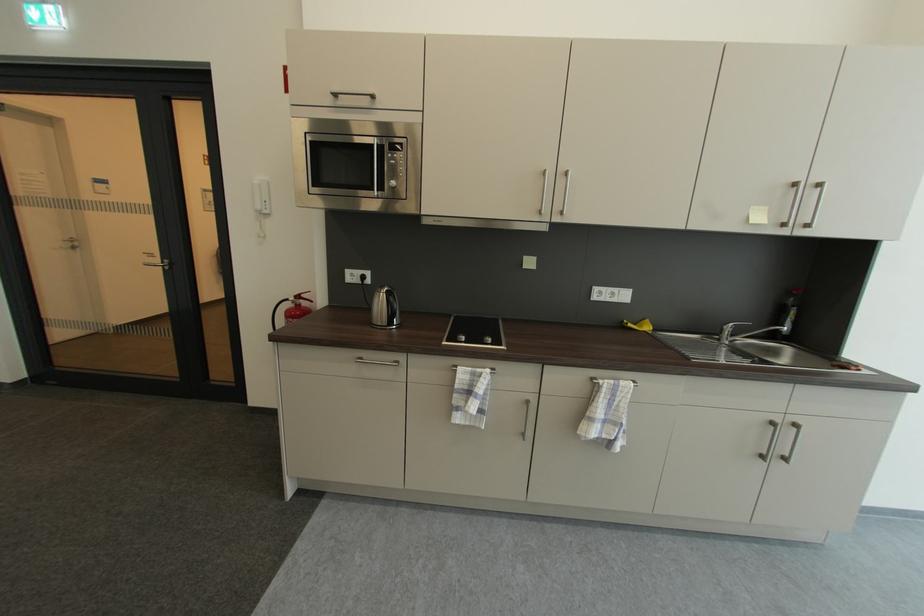
This screenshot has height=616, width=924. What are the coordinates of `silver microwave dial` in the screenshot? It's located at (393, 187).